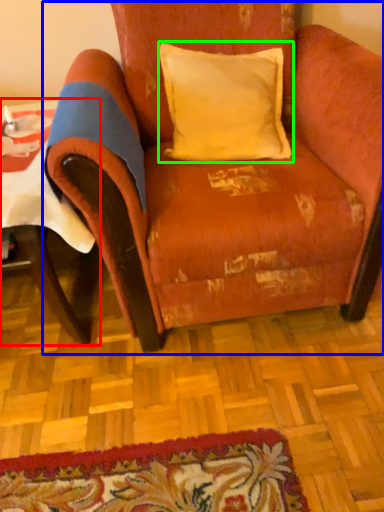
Question: Which object is the farthest from table (highlighted by a red box)? Choose among these: chair (highlighted by a blue box) or pillow (highlighted by a green box).

Choices:
 (A) chair
 (B) pillow

Answer: (B)